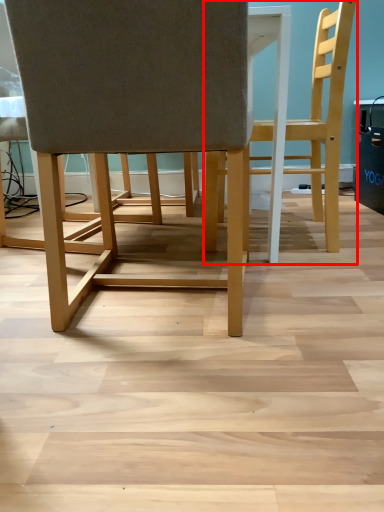
Question: From the image, what is the correct spatial relationship of chair (annotated by the red box) in relation to chair?

Choices:
 (A) left
 (B) right

Answer: (B)